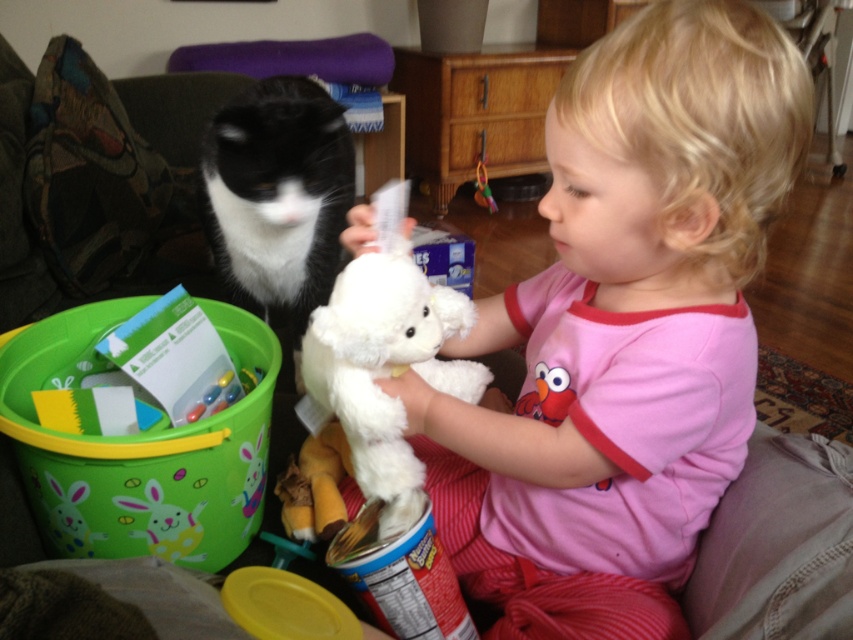
In the scene shown: You are a parent trying to clean up toys. You see the black and white fur cat at left and the white plush at center. Which toy is higher up?

The black and white fur cat at left is located above the white plush at center.

You are a parent trying to locate your child and their cat. The child is holding the white plush toy at center. Where should you look relative to the black and white fur cat at left?

The white plush toy at center is to the right of the black and white fur cat at left, so you should look to the right side of the cat to find the child holding the toy.

From the picture: You are a parent trying to ensure the safety of your child. The black and white fur cat at left and the white plush at center are both near the child. Based on their distance apart, can you determine if they are close enough to be within the child reaching distance simultaneously?

The black and white fur cat at left and white plush at center are 20.30 inches apart. Since the child is seated on the floor, it is possible that both items are within their reaching distance simultaneously, as 20.30 inches is a manageable span for a child to reach in two different directions.